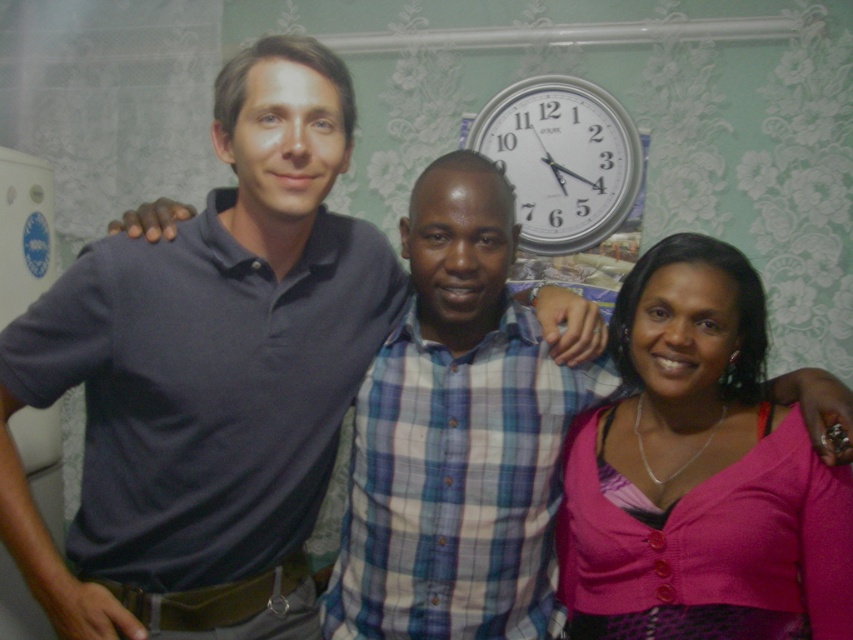
Question: In this image, where is dark blue polo shirt at center located relative to silver metallic clock at upper center?

Choices:
 (A) above
 (B) below

Answer: (B)

Question: Does pink fabric top at center appear on the left side of silver metallic clock at upper center?

Choices:
 (A) yes
 (B) no

Answer: (B)

Question: Considering the real-world distances, which object is farthest from the silver metallic clock at upper center?

Choices:
 (A) dark blue polo shirt at center
 (B) pink fabric top at center

Answer: (A)

Question: Which of the following is the farthest from the observer?

Choices:
 (A) dark blue polo shirt at center
 (B) silver metallic clock at upper center

Answer: (B)

Question: Is dark blue polo shirt at center smaller than pink fabric top at center?

Choices:
 (A) no
 (B) yes

Answer: (A)

Question: Among these objects, which one is nearest to the camera?

Choices:
 (A) pink fabric top at center
 (B) silver metallic clock at upper center
 (C) dark blue polo shirt at center

Answer: (C)